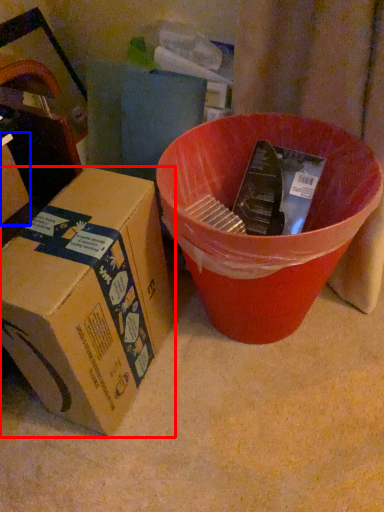
Question: Which object appears closest to the camera in this image, box (highlighted by a red box) or box (highlighted by a blue box)?

Choices:
 (A) box
 (B) box

Answer: (B)